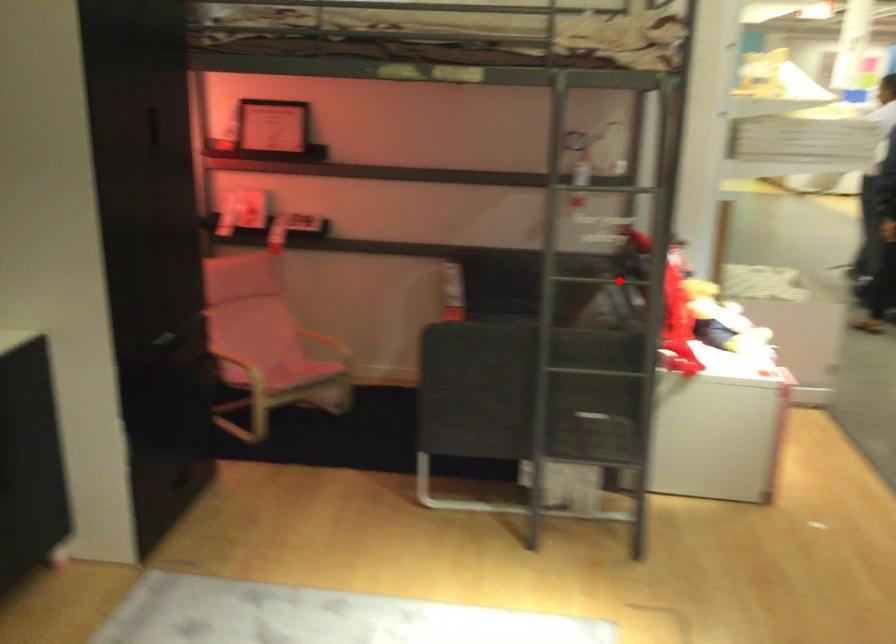
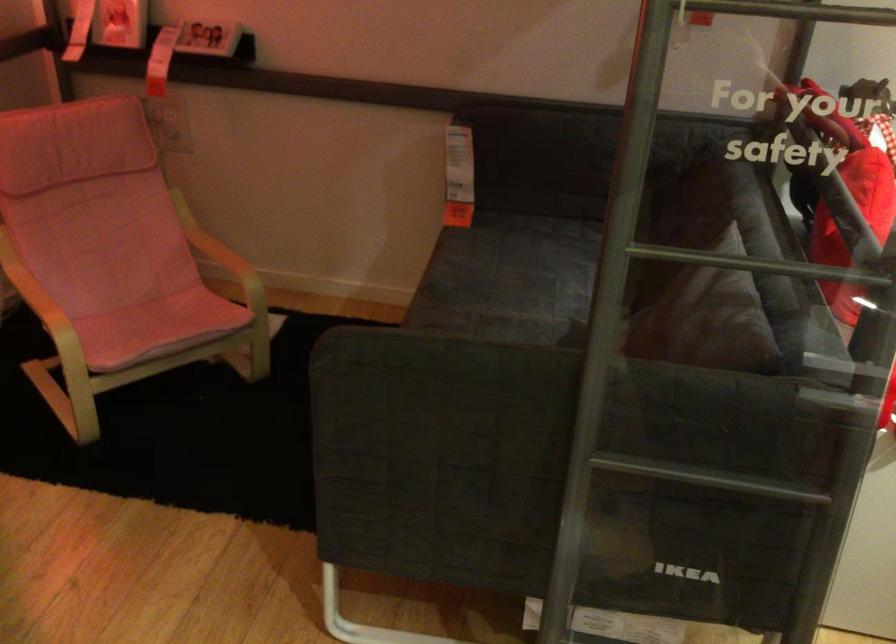
Locate, in the second image, the point that corresponds to the highlighted location in the first image.

(760, 263)